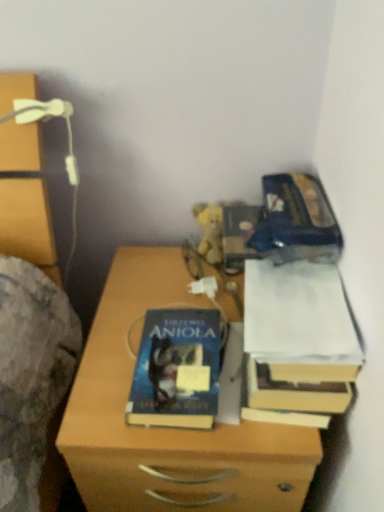
Question: From the image's perspective, is white paper at right above or below wooden chest of drawers at left?

Choices:
 (A) above
 (B) below

Answer: (B)

Question: From a real-world perspective, is white paper at right positioned above or below wooden chest of drawers at left?

Choices:
 (A) below
 (B) above

Answer: (A)

Question: Which is farther from the wooden chest of drawers at left?

Choices:
 (A) wooden nightstand at center
 (B) hardcover book at center
 (C) white paper at right

Answer: (C)

Question: Which of these objects is positioned farthest from the white paper at right?

Choices:
 (A) hardcover book at center
 (B) wooden nightstand at center
 (C) wooden chest of drawers at left

Answer: (C)